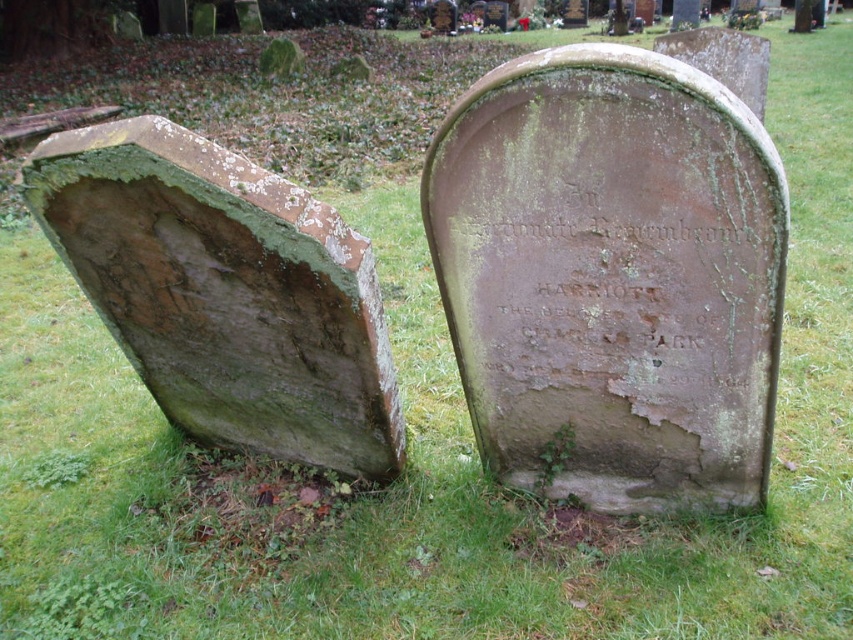
Is green mossy stone at center thinner than green mossy stone at left?

Yes, green mossy stone at center is thinner than green mossy stone at left.

You are a GUI agent. You are given a task and a screenshot of the screen. Output one action in this format:
    pyautogui.click(x=<x>, y=<y>)
    Task: Click on the green mossy stone at center
    The image size is (853, 640).
    Given the screenshot: What is the action you would take?
    pyautogui.click(x=612, y=276)

Is point (521, 480) behind point (360, 412)?

Yes.

You are a GUI agent. You are given a task and a screenshot of the screen. Output one action in this format:
    pyautogui.click(x=<x>, y=<y>)
    Task: Click on the green mossy stone at center
    
    Given the screenshot: What is the action you would take?
    pyautogui.click(x=612, y=276)